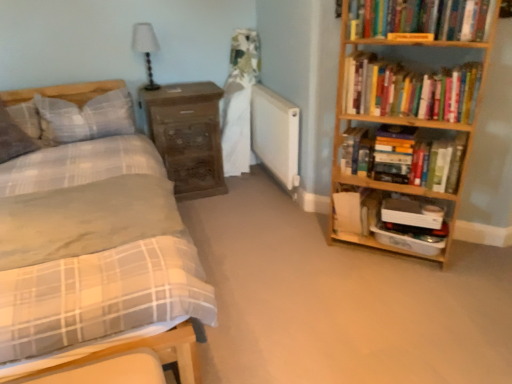
Question: Does wooden bookcase at right have a greater height compared to hardcover book at upper right, arranged as the second paperback book when ordered from the bottom?

Choices:
 (A) yes
 (B) no

Answer: (A)

Question: From the image's perspective, would you say wooden bookcase at right is shown under hardcover book at upper right, which appears as the 2th paperback book when viewed from the back?

Choices:
 (A) no
 (B) yes

Answer: (B)

Question: Is the position of wooden bookcase at right more distant than that of hardcover book at upper right, arranged as the second paperback book when ordered from the bottom?

Choices:
 (A) no
 (B) yes

Answer: (A)

Question: Is wooden bookcase at right placed right next to hardcover book at upper right, which is counted as the first paperback book, starting from the front?

Choices:
 (A) no
 (B) yes

Answer: (A)

Question: Is wooden bookcase at right far away from hardcover book at upper right, arranged as the second paperback book when ordered from the bottom?

Choices:
 (A) yes
 (B) no

Answer: (B)

Question: From a real-world perspective, does wooden bookcase at right sit lower than hardcover book at upper right, which is the 1th paperback book in top-to-bottom order?

Choices:
 (A) no
 (B) yes

Answer: (B)

Question: From the image's perspective, is hardcover book at center right, the 2th paperback book when ordered from top to bottom, on plaid fabric pillow at left, which appears as the second pillow when viewed from the right?

Choices:
 (A) no
 (B) yes

Answer: (A)

Question: From a real-world perspective, is hardcover book at center right, the 2th paperback book when ordered from top to bottom, over plaid fabric pillow at left, which appears as the second pillow when viewed from the right?

Choices:
 (A) yes
 (B) no

Answer: (B)

Question: Is hardcover book at center right, marked as the 2th paperback book in a front-to-back arrangement, smaller than plaid fabric pillow at left, the 1th pillow from the left?

Choices:
 (A) yes
 (B) no

Answer: (A)

Question: Is hardcover book at center right, the 2th paperback book when ordered from top to bottom, positioned beyond the bounds of plaid fabric pillow at left, the 1th pillow from the left?

Choices:
 (A) yes
 (B) no

Answer: (A)

Question: Is the position of hardcover book at center right, the 2th paperback book when ordered from top to bottom, more distant than that of plaid fabric pillow at left, which appears as the second pillow when viewed from the right?

Choices:
 (A) yes
 (B) no

Answer: (B)

Question: Can you confirm if hardcover book at center right, marked as the 1th paperback book in a bottom-to-top arrangement, is wider than plaid fabric pillow at left, the 1th pillow from the left?

Choices:
 (A) yes
 (B) no

Answer: (B)

Question: Could you tell me if plaid fabric pillow at left, the 1th pillow from the left, is turned towards hardcover books at right, arranged as the 3th book when viewed from the top?

Choices:
 (A) yes
 (B) no

Answer: (B)